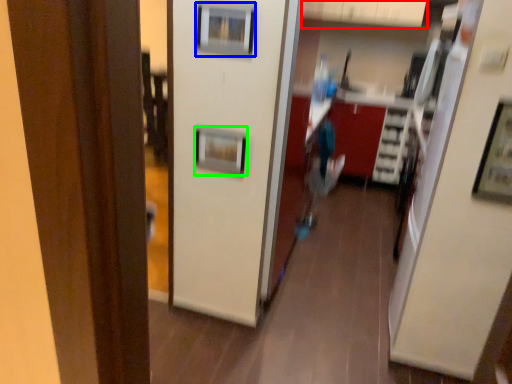
Question: Estimate the real-world distances between objects in this image. Which object is farther from cabinetry (highlighted by a red box), picture frame (highlighted by a blue box) or picture frame (highlighted by a green box)?

Choices:
 (A) picture frame
 (B) picture frame

Answer: (B)